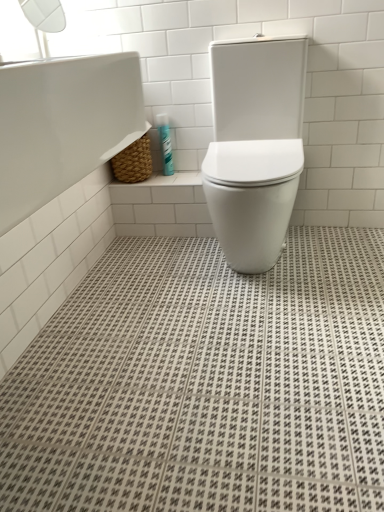
This screenshot has height=512, width=384. I want to click on free space in front of teal plastic toothpaste tube at upper center, so pos(178,178).